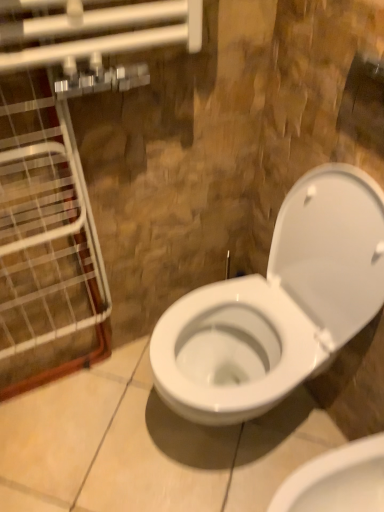
Locate an element on the screen. vacant space situated on the left part of white glossy toilet at center, the second toilet from the bottom is located at coordinates (110, 433).